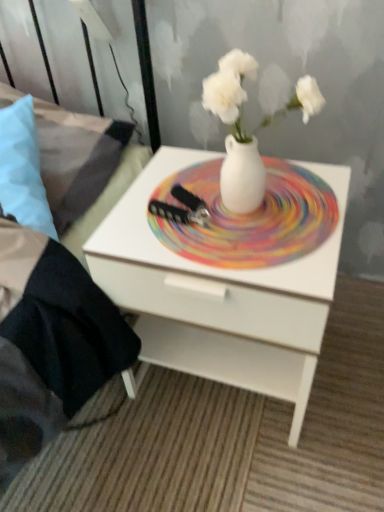
Identify the location of vacant space in white glossy plate at center (from a real-world perspective). (272, 183).